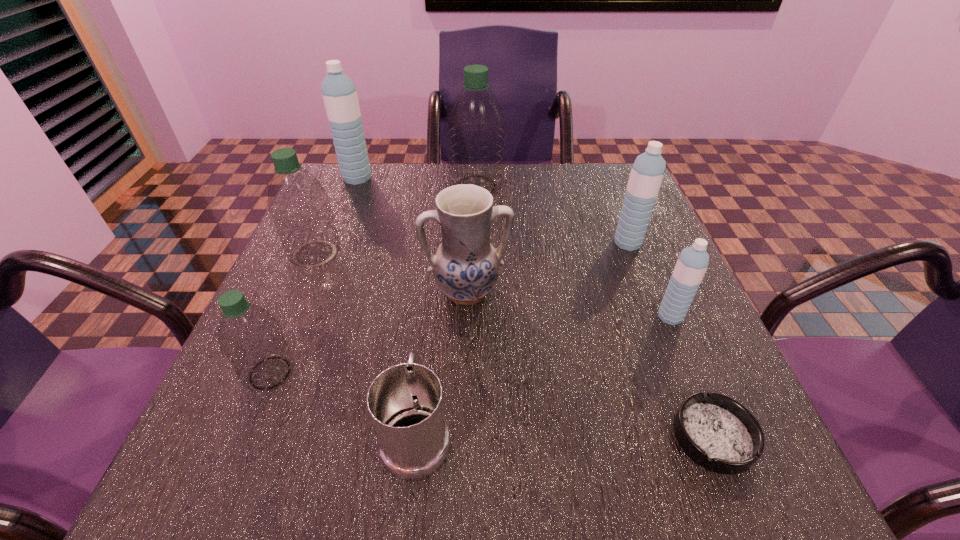
Find the location of a particular element. vacant space located 0.120m on the back of the second nearest water bottle is located at coordinates (649, 266).

At what (x,y) coordinates should I click in order to perform the action: click on vacant region located 0.250m on the right of the nearest water bottle. Please return your answer as a coordinate pair (x, y). The height and width of the screenshot is (540, 960). Looking at the image, I should click on (444, 373).

Where is `vacant space located on the side of the eighth tallest object with the handle`? vacant space located on the side of the eighth tallest object with the handle is located at coordinates (433, 284).

What are the coordinates of `free space located 0.120m on the side of the eighth tallest object with the handle` in the screenshot? It's located at (428, 334).

Locate an element on the screen. vacant space located 0.080m on the side of the eighth tallest object with the handle is located at coordinates (426, 351).

The image size is (960, 540). I want to click on vacant space located on the back of the shortest object, so click(x=647, y=275).

This screenshot has width=960, height=540. Find the location of `mug present at the near edge`. mug present at the near edge is located at coordinates (405, 402).

Locate an element on the screen. The image size is (960, 540). ashtray at the near edge is located at coordinates (717, 432).

This screenshot has width=960, height=540. Identify the location of ashtray that is at the right edge. (717, 432).

Where is `object that is positioned at the far left corner`? This screenshot has width=960, height=540. object that is positioned at the far left corner is located at coordinates (339, 94).